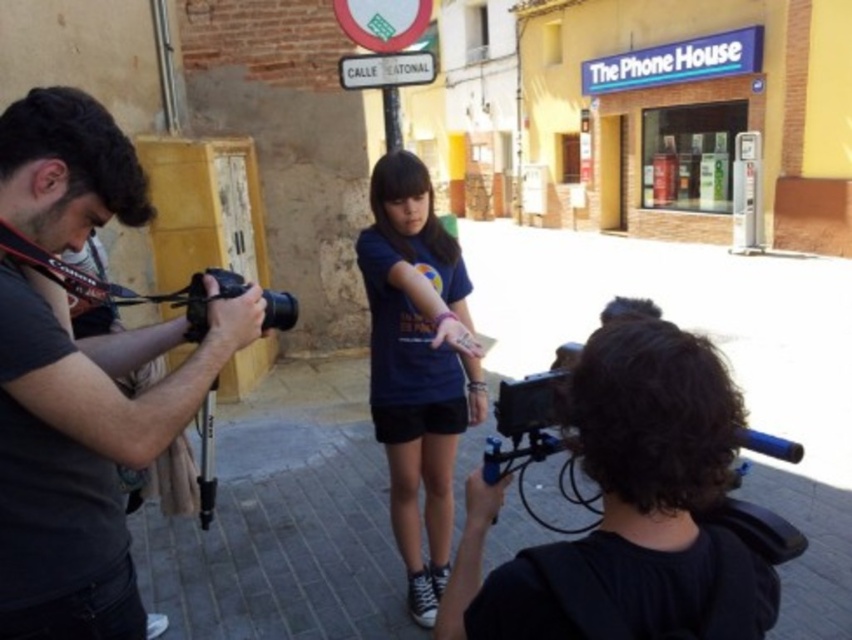
Is dark gray shirt at left closer to camera compared to black plastic camera at left?

Yes, it is in front of black plastic camera at left.

Between dark gray shirt at left and black plastic camera at left, which one has less height?

black plastic camera at left

Image resolution: width=852 pixels, height=640 pixels. Describe the element at coordinates (85, 456) in the screenshot. I see `dark gray shirt at left` at that location.

The image size is (852, 640). I want to click on dark gray shirt at left, so click(x=85, y=456).

Is dark gray shirt at left positioned before matte blue t-shirt at center?

Yes, dark gray shirt at left is in front of matte blue t-shirt at center.

Is point (10, 426) closer to viewer compared to point (438, 243)?

Yes, it is in front of point (438, 243).

This screenshot has width=852, height=640. What do you see at coordinates (85, 456) in the screenshot?
I see `dark gray shirt at left` at bounding box center [85, 456].

The height and width of the screenshot is (640, 852). I want to click on dark gray shirt at left, so click(x=85, y=456).

Does black plastic camera at left appear under white plastic street sign at upper center?

Yes.

Looking at this image, measure the distance between black plastic camera at left and white plastic street sign at upper center.

The distance of black plastic camera at left from white plastic street sign at upper center is 3.42 meters.

Which is in front, point (188, 307) or point (421, 72)?

Point (188, 307) is more forward.

At what (x,y) coordinates should I click in order to perform the action: click on black plastic camera at left. Please return your answer as a coordinate pair (x, y). Looking at the image, I should click on [204, 298].